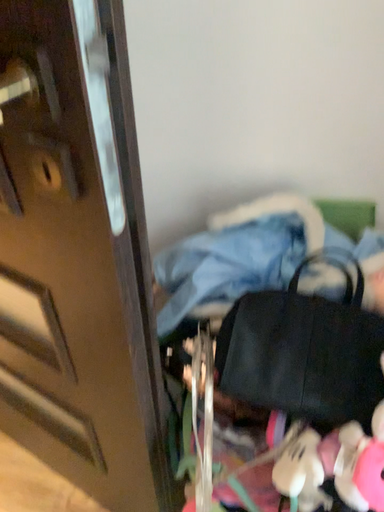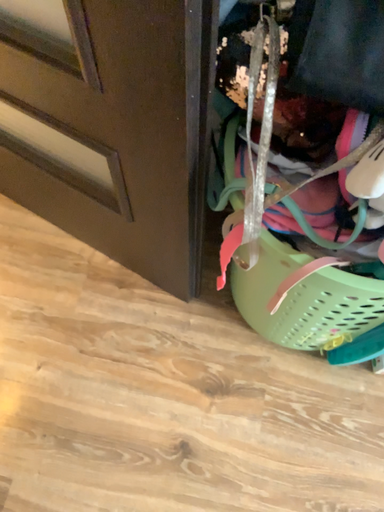
Question: Which way did the camera rotate in the video?

Choices:
 (A) rotated downward
 (B) rotated upward

Answer: (A)